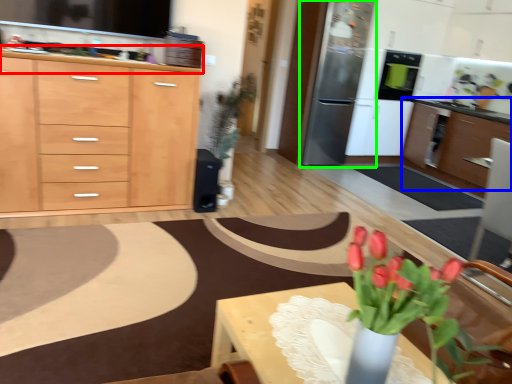
Question: Considering the real-world distances, which object is farthest from countertop (highlighted by a red box)? cabinetry (highlighted by a blue box) or appliance (highlighted by a green box)?

Choices:
 (A) cabinetry
 (B) appliance

Answer: (A)